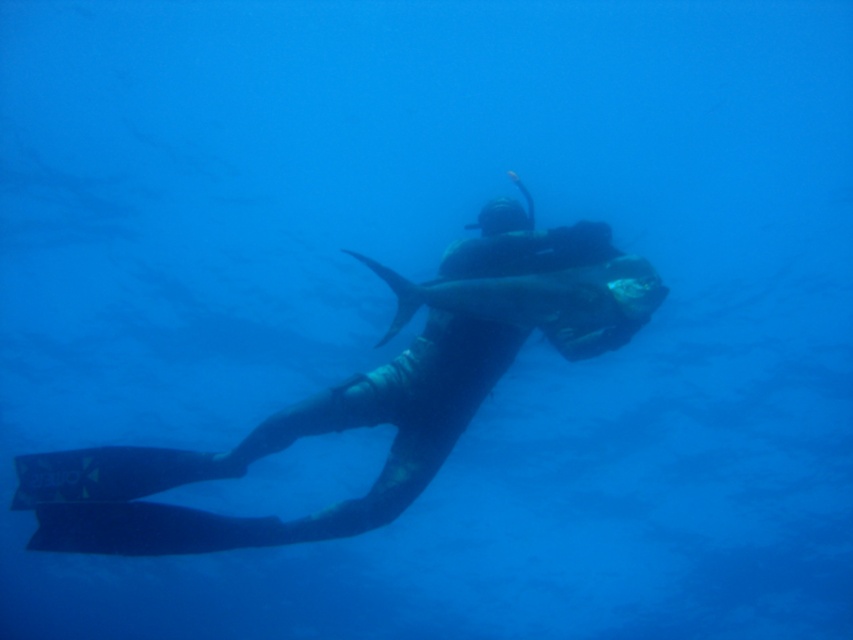
Question: Does black rubber wetsuit at center have a larger size compared to shiny silver fish at center?

Choices:
 (A) yes
 (B) no

Answer: (A)

Question: Can you confirm if black rubber wetsuit at center is thinner than shiny silver fish at center?

Choices:
 (A) yes
 (B) no

Answer: (B)

Question: Does black rubber wetsuit at center appear under shiny silver fish at center?

Choices:
 (A) yes
 (B) no

Answer: (A)

Question: Which point is closer to the camera?

Choices:
 (A) black rubber wetsuit at center
 (B) shiny silver fish at center

Answer: (A)

Question: Which object is closer to the camera taking this photo?

Choices:
 (A) shiny silver fish at center
 (B) black rubber wetsuit at center

Answer: (B)